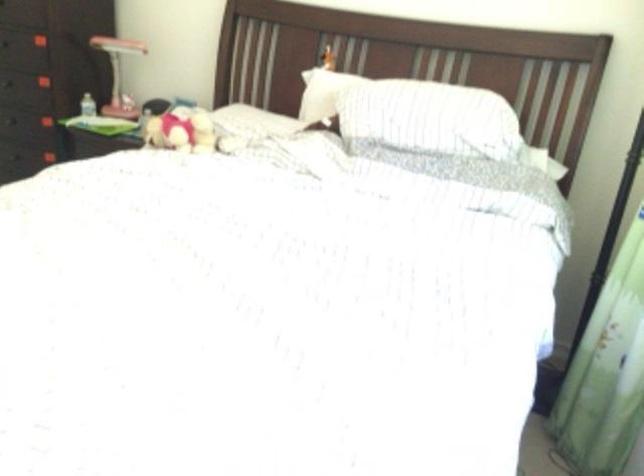
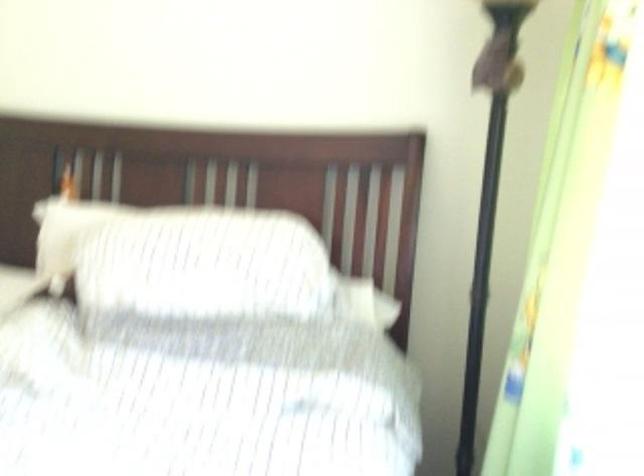
Where in the second image is the point corresponding to point (431, 113) from the first image?

(204, 267)